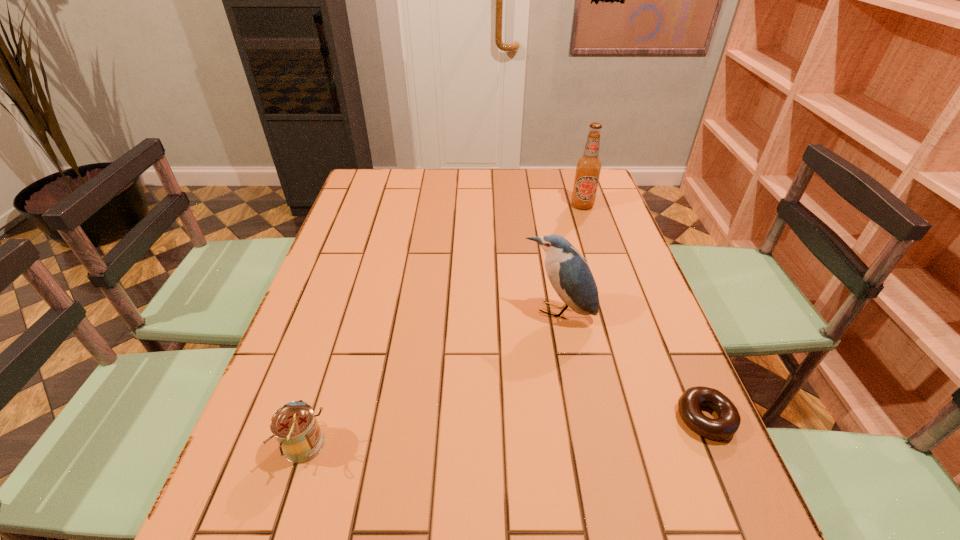
This screenshot has height=540, width=960. Find the location of `the second shortest object`. the second shortest object is located at coordinates (294, 425).

The width and height of the screenshot is (960, 540). What are the coordinates of `the leftmost object` in the screenshot? It's located at (294, 425).

This screenshot has width=960, height=540. I want to click on doughnut, so click(x=728, y=422).

In order to click on the shortest object in this screenshot , I will do `click(728, 422)`.

This screenshot has width=960, height=540. Find the location of `beer bottle`. beer bottle is located at coordinates [x=588, y=167].

Find the location of `the second object from right to left`. the second object from right to left is located at coordinates (588, 167).

Identify the location of bird. Image resolution: width=960 pixels, height=540 pixels. (569, 274).

Image resolution: width=960 pixels, height=540 pixels. Find the location of `the third shortest object`. the third shortest object is located at coordinates (569, 274).

Locate an element on the screen. vacant space located 0.310m on the right of the can is located at coordinates (495, 446).

Identify the location of vacant space situated 0.400m on the back of the rightmost object. This screenshot has height=540, width=960. (643, 272).